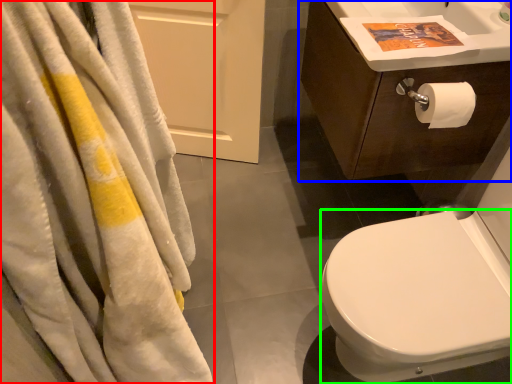
Question: Based on their relative distances, which object is farther from towel (highlighted by a red box)? Choose from bathroom cabinet (highlighted by a blue box) and bidet (highlighted by a green box).

Choices:
 (A) bathroom cabinet
 (B) bidet

Answer: (A)